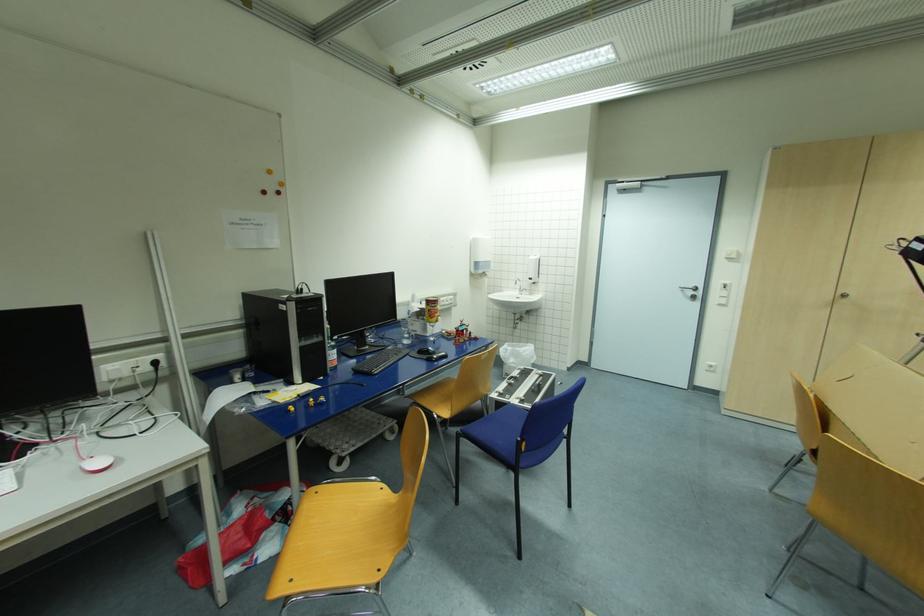
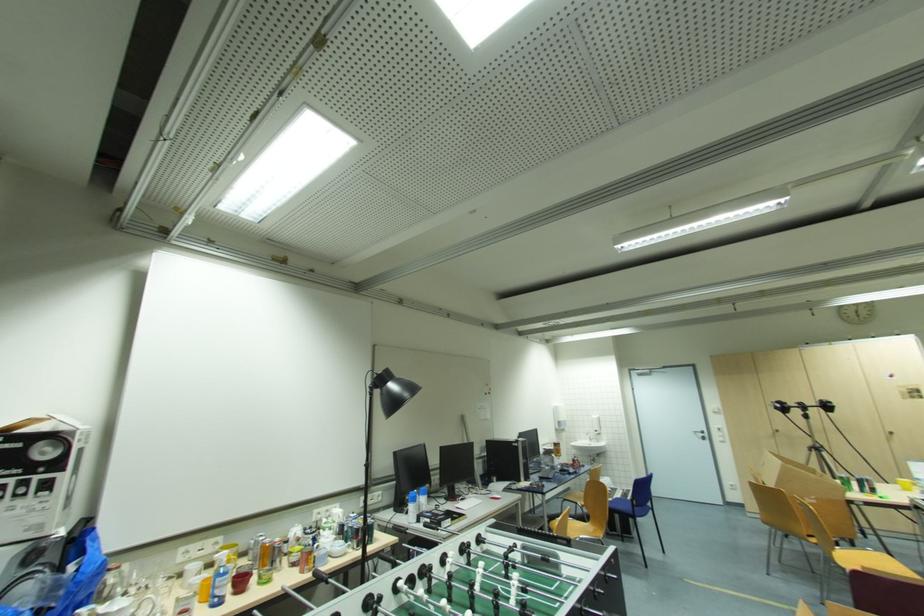
In the second image, find the point that corresponds to (535,282) in the first image.

(601, 434)